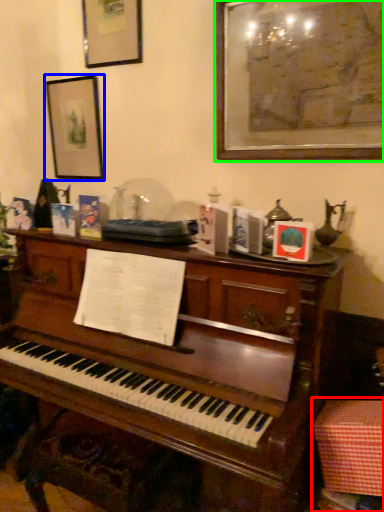
Question: Considering the real-world distances, which object is farthest from table (highlighted by a red box)? picture frame (highlighted by a blue box) or picture frame (highlighted by a green box)?

Choices:
 (A) picture frame
 (B) picture frame

Answer: (A)